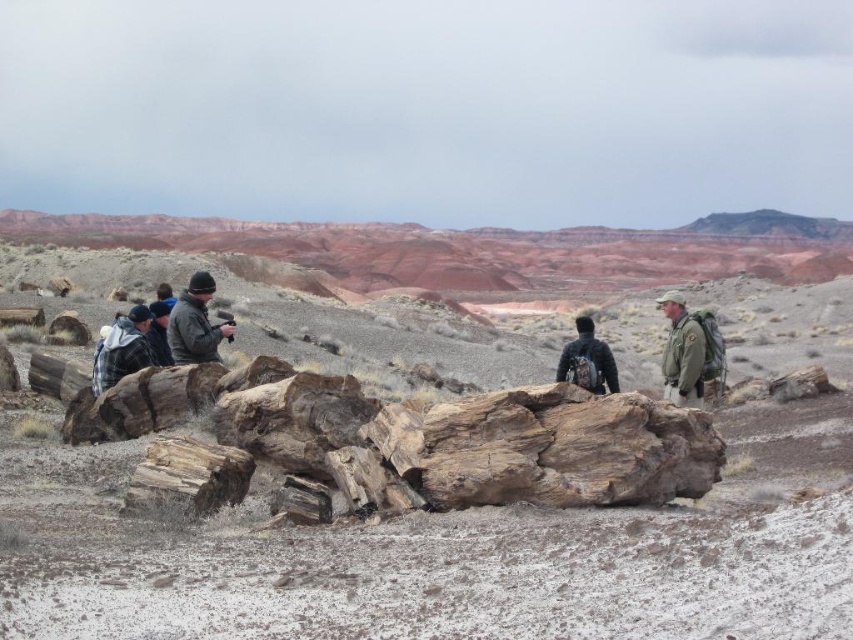
You are a hiker trying to navigate through the desert. You see the rusty wood log at center. Can you estimate its exact location in the scene?

The rusty wood log at center is located at point (405,442) in the scene.

You are an adventurer in the desert and need to decide which jacket to wear. The dark gray wool jacket at center is above the plaid fabric jacket at left. Which jacket is positioned higher in the image?

The dark gray wool jacket at center is positioned higher in the image than the plaid fabric jacket at left.

You are a hiker carrying a plaid fabric jacket at left. You want to place it on the weathered wood at center. Will the jacket fit entirely on the wood?

The weathered wood at center might be wider than plaid fabric jacket at left, so there is a possibility that the jacket will fit entirely on the wood. However, since the exact dimensions are uncertain, it is advisable to check the actual size before placing the jacket.